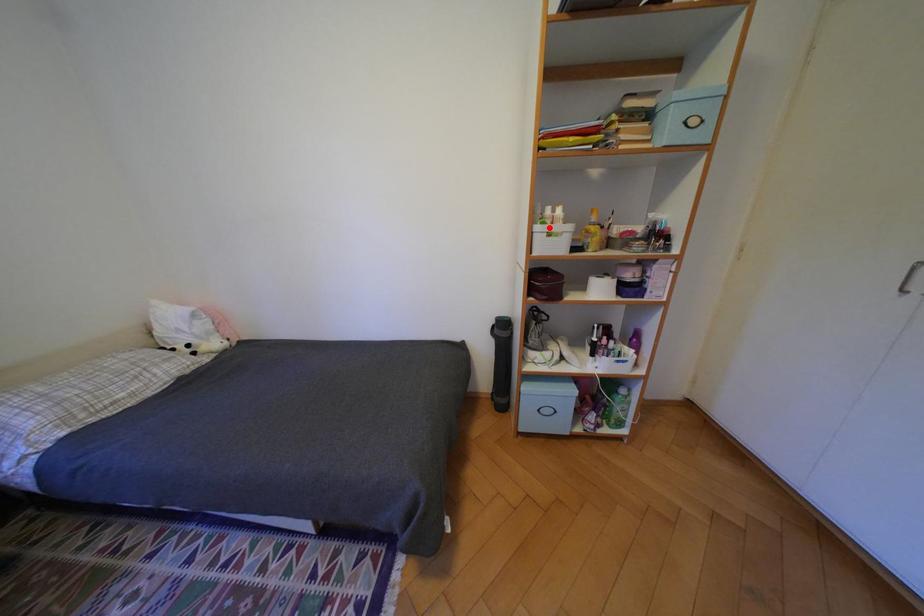
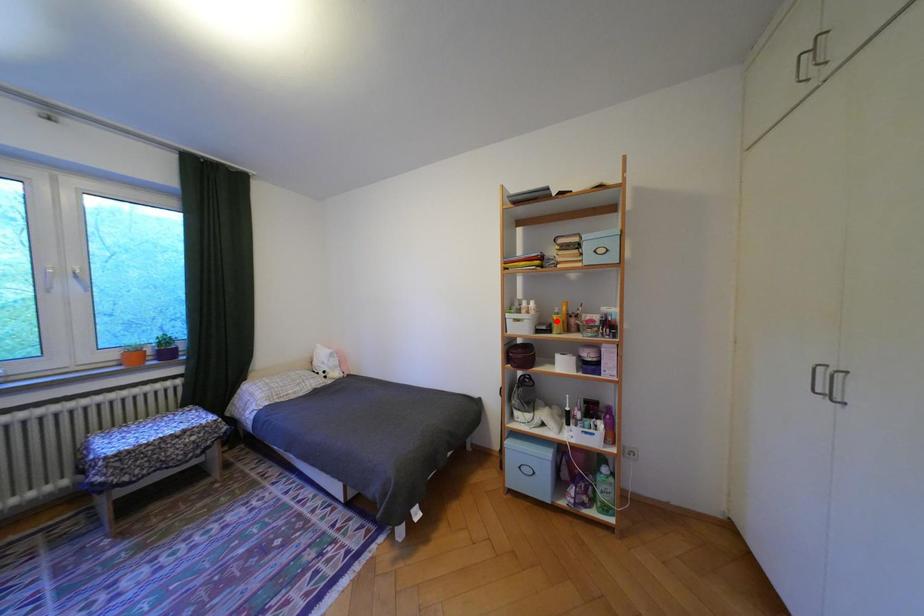
I am providing you with two images of the same scene from different viewpoints. A red point is marked on the first image and another point is marked on the second image. Are the points marked in image1 and image2 representing the same 3D position?

No